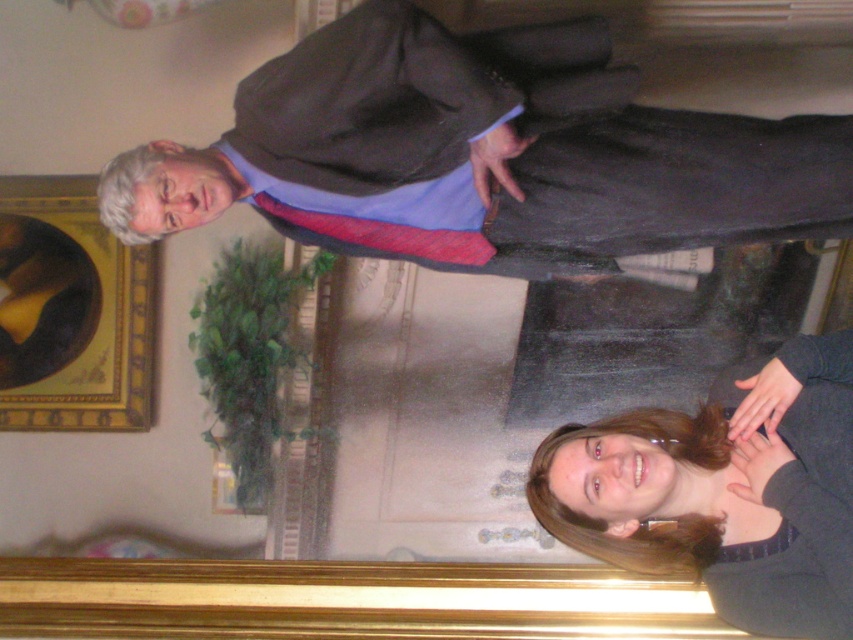
What do you see at coordinates (483, 154) in the screenshot?
I see `matte black suit at upper center` at bounding box center [483, 154].

I want to click on matte black suit at upper center, so click(483, 154).

From the picture: Who is higher up, matte black suit at upper center or goldwooden frame at upper left?

matte black suit at upper center is above.

Who is more forward, (300, 132) or (149, 301)?

Point (300, 132) is in front.

The height and width of the screenshot is (640, 853). What are the coordinates of `matte black suit at upper center` in the screenshot? It's located at (483, 154).

Can you confirm if dark brown hair at lower right is positioned to the right of goldwooden frame at upper left?

Yes, dark brown hair at lower right is to the right of goldwooden frame at upper left.

Is dark brown hair at lower right above goldwooden frame at upper left?

No.

Which is behind, point (654, 424) or point (140, 404)?

Point (140, 404)

Where is `dark brown hair at lower right`? The height and width of the screenshot is (640, 853). dark brown hair at lower right is located at coordinates (724, 492).